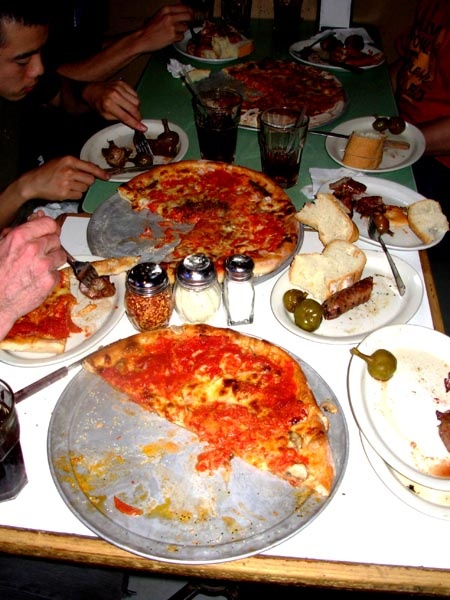
This screenshot has width=450, height=600. Identify the location of oval plate. (398, 405).